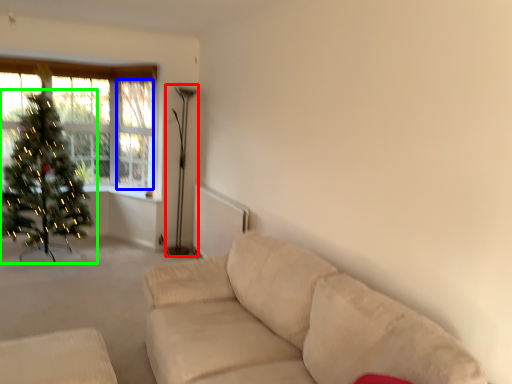
Question: Which object is positioned closest to lamp (highlighted by a red box)? Select from window screen (highlighted by a blue box) and christmas tree (highlighted by a green box).

Choices:
 (A) window screen
 (B) christmas tree

Answer: (A)